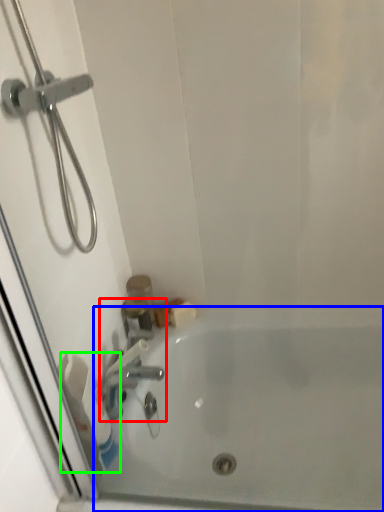
Question: Which is nearer to the tap (highlighted by a red box)? bathtub (highlighted by a blue box) or toilet paper (highlighted by a green box).

Choices:
 (A) bathtub
 (B) toilet paper

Answer: (B)